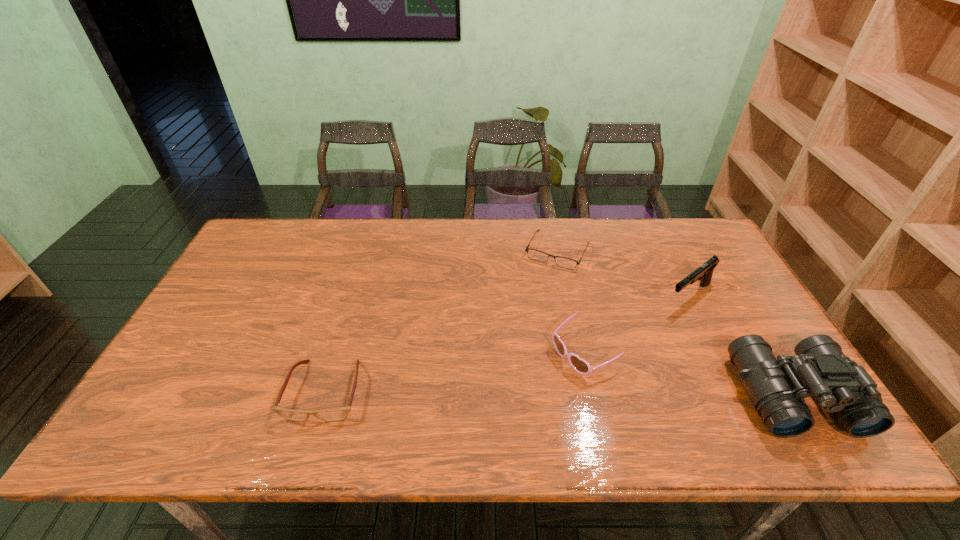
Where is `vacant area situated 0.250m at the aiming end of the fourth shortest object`? vacant area situated 0.250m at the aiming end of the fourth shortest object is located at coordinates (615, 350).

What are the coordinates of `vacant space located on the front-facing side of the shorter spectacles` in the screenshot? It's located at (540, 286).

Image resolution: width=960 pixels, height=540 pixels. In order to click on free space located 0.050m on the front-facing side of the shorter spectacles in this screenshot , I will do `click(542, 280)`.

This screenshot has width=960, height=540. I want to click on vacant area situated 0.130m on the front-facing side of the shorter spectacles, so click(535, 297).

The image size is (960, 540). What are the coordinates of `vacant space situated 0.050m on the front-facing side of the sunglasses` in the screenshot? It's located at (544, 378).

I want to click on free location located on the front-facing side of the sunglasses, so click(532, 386).

Where is `blank space located 0.180m on the front-facing side of the sunglasses`? The height and width of the screenshot is (540, 960). blank space located 0.180m on the front-facing side of the sunglasses is located at coordinates (502, 404).

You are a GUI agent. You are given a task and a screenshot of the screen. Output one action in this format:
    pyautogui.click(x=<x>, y=<y>)
    Task: Click on the object that is at the far edge
    The height and width of the screenshot is (540, 960).
    Given the screenshot: What is the action you would take?
    pyautogui.click(x=564, y=262)

Locate an element on the screen. The image size is (960, 540). spectacles present at the near edge is located at coordinates (338, 414).

Where is `binoculars that is at the near edge`? This screenshot has width=960, height=540. binoculars that is at the near edge is located at coordinates (777, 387).